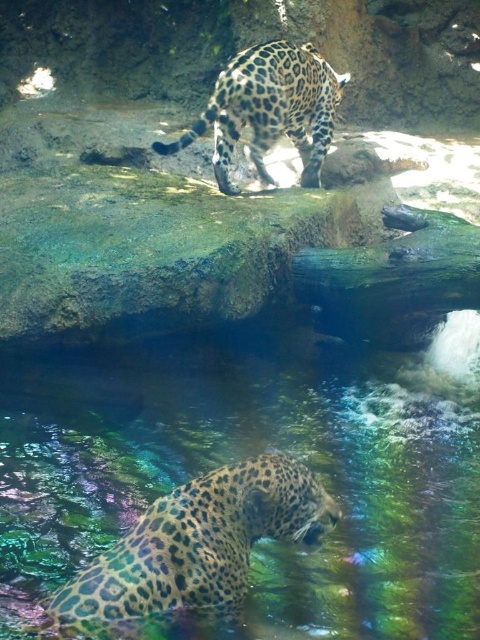
The height and width of the screenshot is (640, 480). What are the coordinates of `translucent glass water at center` in the screenshot? It's located at (256, 451).

Who is higher up, translucent glass water at center or spotted fur jaguar at upper center?

spotted fur jaguar at upper center is higher up.

Is point (478, 586) more distant than point (180, 134)?

No, (478, 586) is in front of (180, 134).

Find the location of a particular element. translucent glass water at center is located at coordinates (256, 451).

Does spotted fur jaguar at lower left have a larger size compared to spotted fur jaguar at upper center?

No.

Based on the photo, is spotted fur jaguar at lower left shorter than spotted fur jaguar at upper center?

Indeed, spotted fur jaguar at lower left has a lesser height compared to spotted fur jaguar at upper center.

The height and width of the screenshot is (640, 480). Find the location of `spotted fur jaguar at lower left`. spotted fur jaguar at lower left is located at coordinates (194, 547).

Image resolution: width=480 pixels, height=640 pixels. Identify the location of spotted fur jaguar at lower left. (194, 547).

Who is shorter, translucent glass water at center or spotted fur jaguar at lower left?

With less height is spotted fur jaguar at lower left.

In the scene shown: Measure the distance between translucent glass water at center and spotted fur jaguar at lower left.

translucent glass water at center and spotted fur jaguar at lower left are 3.86 feet apart from each other.

The width and height of the screenshot is (480, 640). Identify the location of translucent glass water at center. (256, 451).